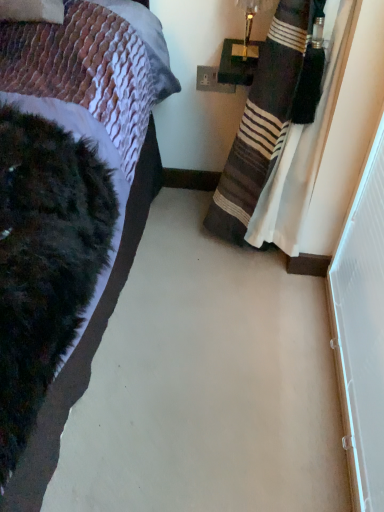
Question: Would you say white plastic power outlet at upper center is to the left or to the right of metallic gold lamp at upper right in the picture?

Choices:
 (A) right
 (B) left

Answer: (B)

Question: From a real-world perspective, is white plastic power outlet at upper center above or below metallic gold lamp at upper right?

Choices:
 (A) above
 (B) below

Answer: (B)

Question: Which is nearer to the white plastic screen door at right?

Choices:
 (A) striped fabric curtain at right
 (B) metallic gold lamp at upper right
 (C) white plastic power outlet at upper center

Answer: (A)

Question: Estimate the real-world distances between objects in this image. Which object is closer to the white plastic screen door at right?

Choices:
 (A) white plastic power outlet at upper center
 (B) striped fabric curtain at right
 (C) metallic gold lamp at upper right

Answer: (B)